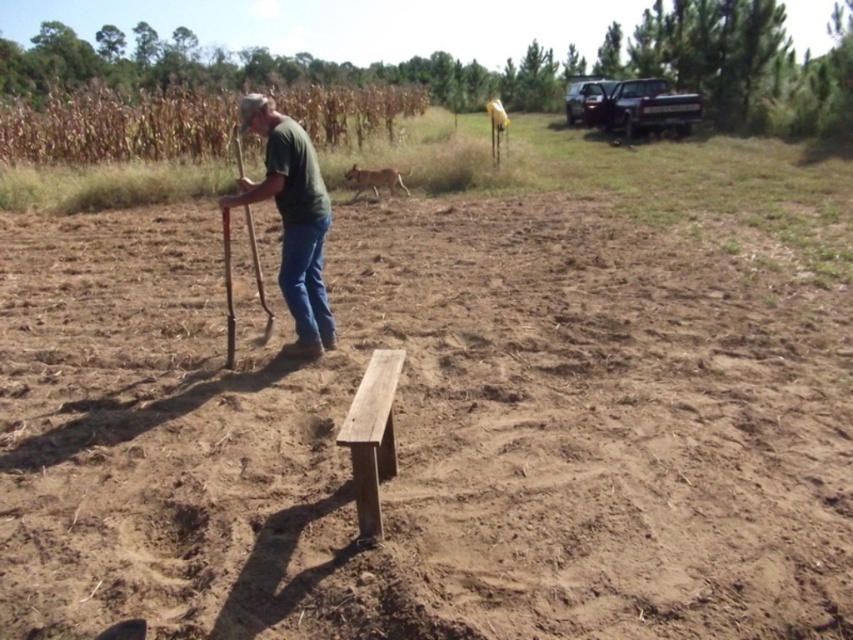
Question: From the image, what is the correct spatial relationship of green matte shirt at center in relation to wooden shovel at center?

Choices:
 (A) right
 (B) left

Answer: (A)

Question: Which of the following is the closest to the observer?

Choices:
 (A) brown stalks of corn at upper left
 (B) wooden shovel at center
 (C) smooth brown bench at center
 (D) brown rough dirt at center

Answer: (D)

Question: Is blue denim jeans at center to the left of wooden shovel at center from the viewer's perspective?

Choices:
 (A) yes
 (B) no

Answer: (B)

Question: Can you confirm if brown rough dirt at center is positioned to the left of brown stalks of corn at upper left?

Choices:
 (A) no
 (B) yes

Answer: (A)

Question: Which object appears farthest from the camera in this image?

Choices:
 (A) brown stalks of corn at upper left
 (B) smooth brown bench at center

Answer: (A)

Question: Which point is farther from the camera taking this photo?

Choices:
 (A) (67, 129)
 (B) (300, 307)
 (C) (364, 531)

Answer: (A)